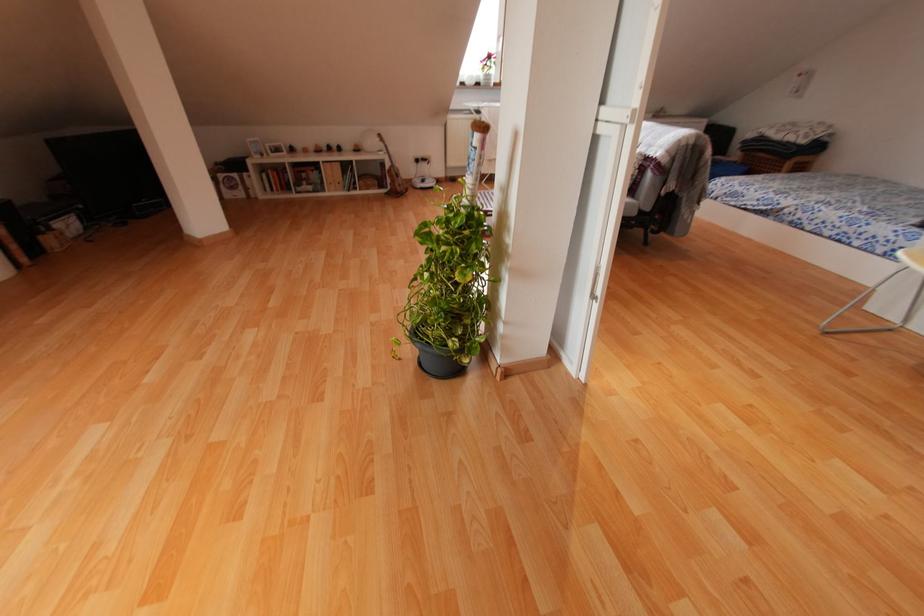
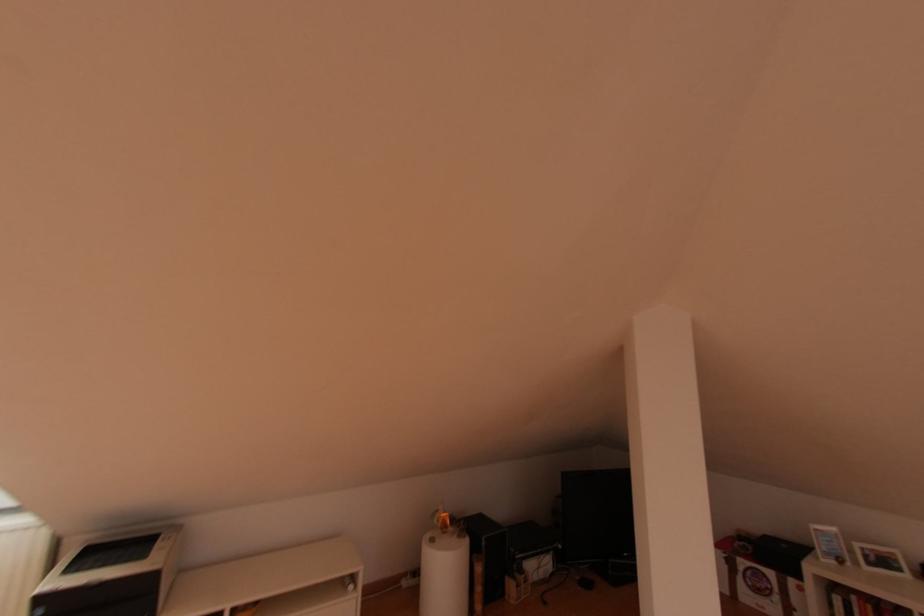
Where in the second image is the point corresponding to the point at 51,241 from the first image?

(511, 589)